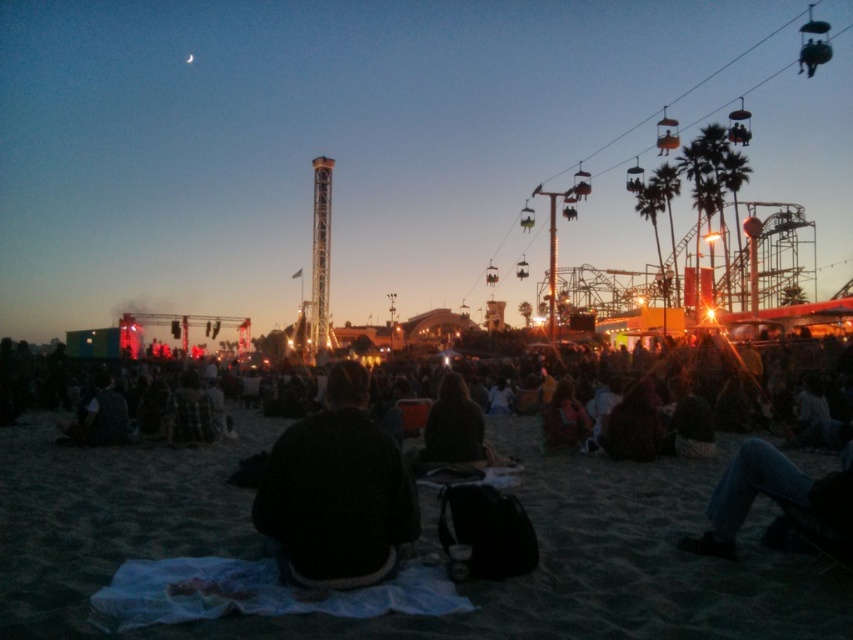
Question: Can you confirm if black sweater at center is positioned below dark brown sweater at center?

Choices:
 (A) no
 (B) yes

Answer: (B)

Question: Which object appears closest to the camera in this image?

Choices:
 (A) black sweater at center
 (B) dark brown sweater at center

Answer: (A)

Question: Which point is closer to the camera?

Choices:
 (A) (352, 529)
 (B) (462, 432)

Answer: (A)

Question: Can you confirm if black sweater at center is positioned to the left of dark brown sweater at center?

Choices:
 (A) yes
 (B) no

Answer: (A)

Question: Does black sweater at center have a greater width compared to dark brown sweater at center?

Choices:
 (A) no
 (B) yes

Answer: (B)

Question: Which point is farther to the camera?

Choices:
 (A) (462, 388)
 (B) (335, 465)

Answer: (A)